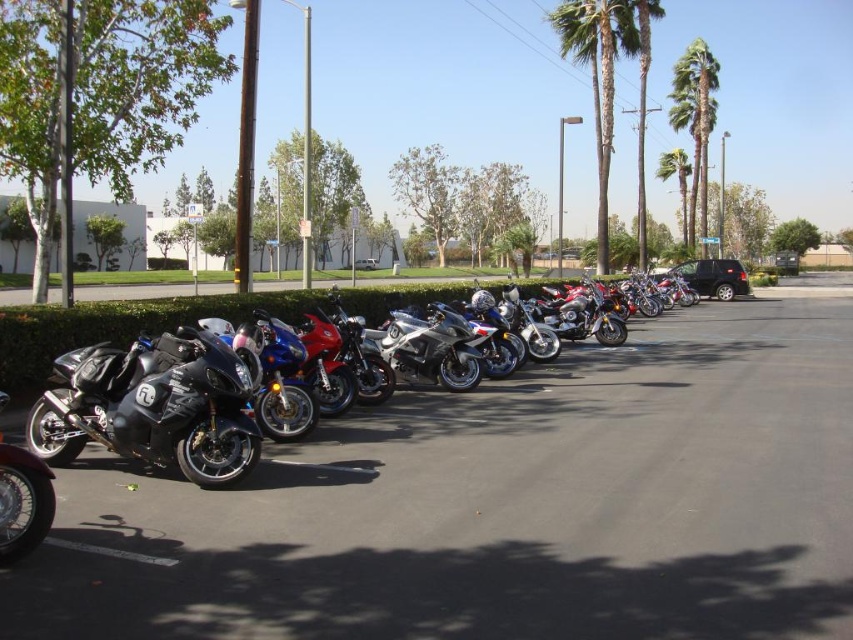
This screenshot has height=640, width=853. What do you see at coordinates (154, 406) in the screenshot? I see `shiny black motorcycle at left` at bounding box center [154, 406].

Between shiny black motorcycle at left and silver metallic sportbike at center, which one has more height?

silver metallic sportbike at center

Is point (167, 456) more distant than point (471, 300)?

No, it is not.

Image resolution: width=853 pixels, height=640 pixels. Identify the location of shiny black motorcycle at left. (154, 406).

Between metallic motorcycles at center and silver metallic sportbike at center, which one is positioned higher?

silver metallic sportbike at center is above.

Does metallic motorcycles at center appear over silver metallic sportbike at center?

Actually, metallic motorcycles at center is below silver metallic sportbike at center.

The width and height of the screenshot is (853, 640). What do you see at coordinates (502, 506) in the screenshot?
I see `metallic motorcycles at center` at bounding box center [502, 506].

Locate an element on the screen. This screenshot has width=853, height=640. metallic motorcycles at center is located at coordinates (502, 506).

Is metallic motorcycles at center closer to the viewer compared to satin silver motorcycle at center?

Yes.

What do you see at coordinates (502, 506) in the screenshot? I see `metallic motorcycles at center` at bounding box center [502, 506].

This screenshot has height=640, width=853. Find the location of `metallic motorcycles at center`. metallic motorcycles at center is located at coordinates (502, 506).